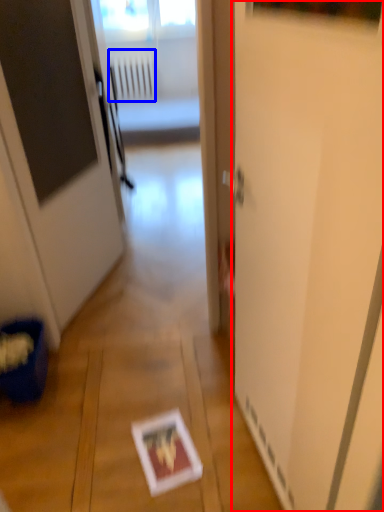
Question: Which point is further to the camera, screen door (highlighted by a red box) or radiator (highlighted by a blue box)?

Choices:
 (A) screen door
 (B) radiator

Answer: (B)